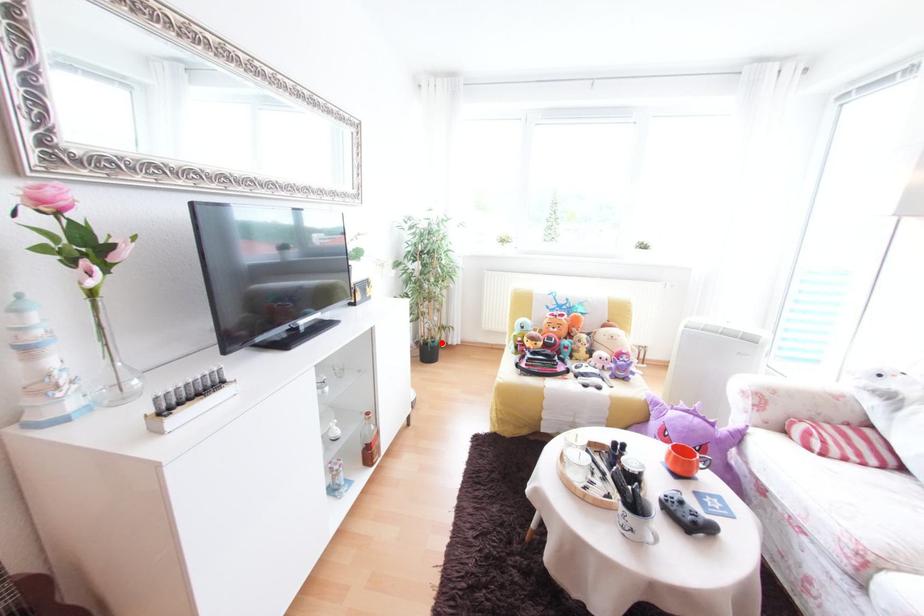
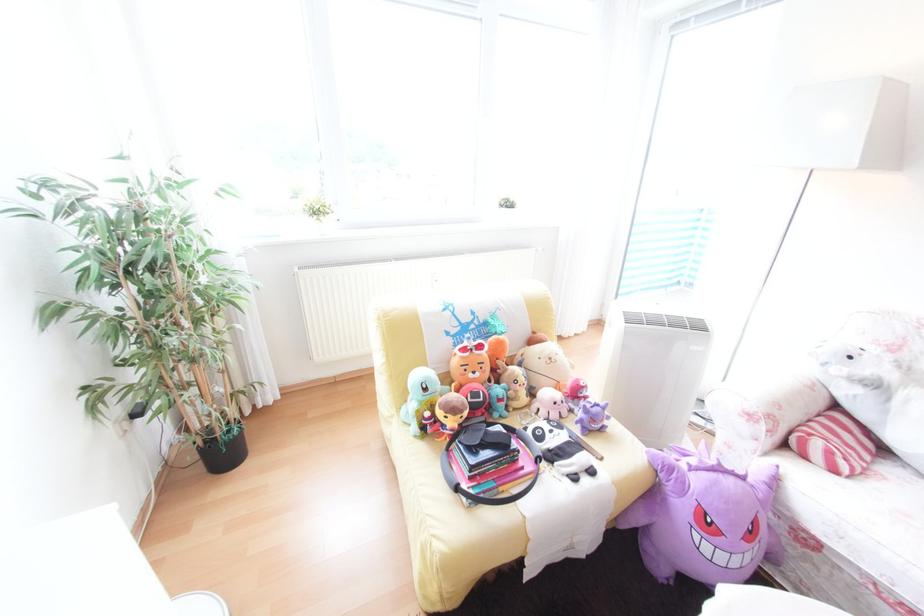
Where in the second image is the point corresponding to the highlighted location from the first image?

(237, 432)